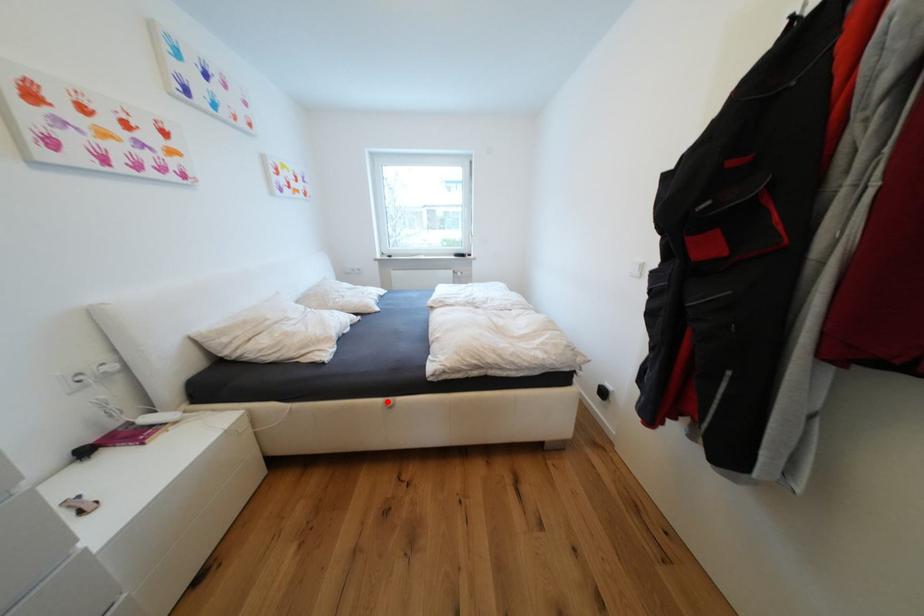
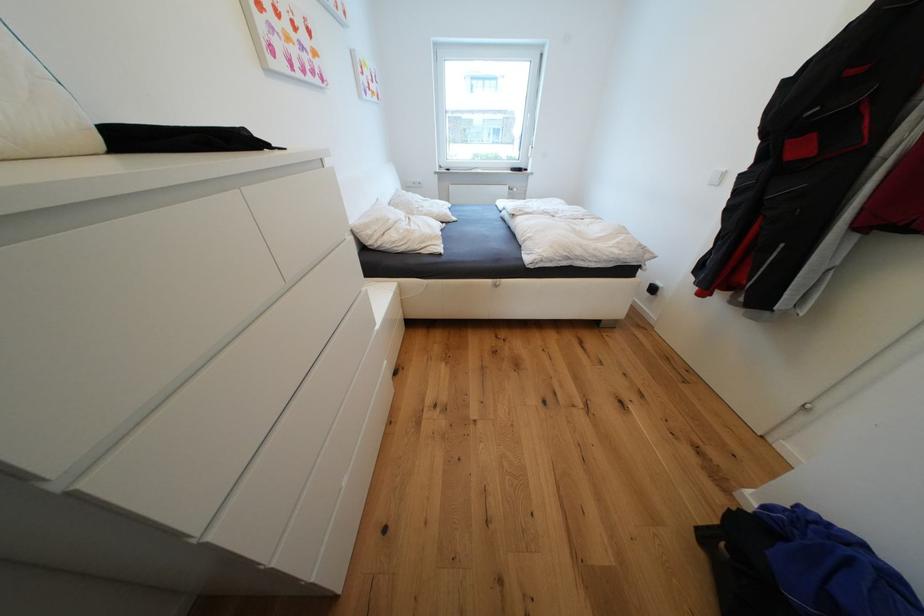
Find the pixel in the second image that matches the highlighted location in the first image.

(496, 282)